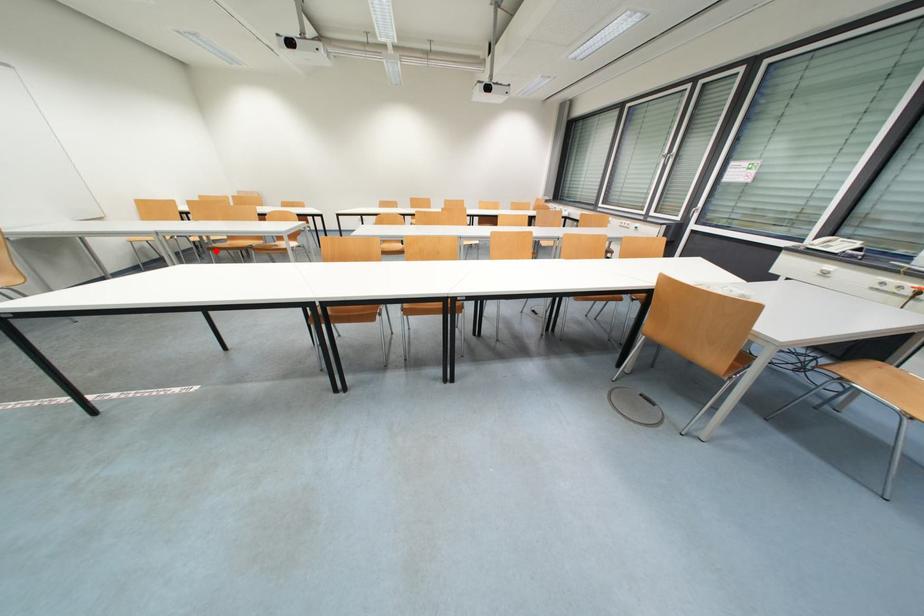
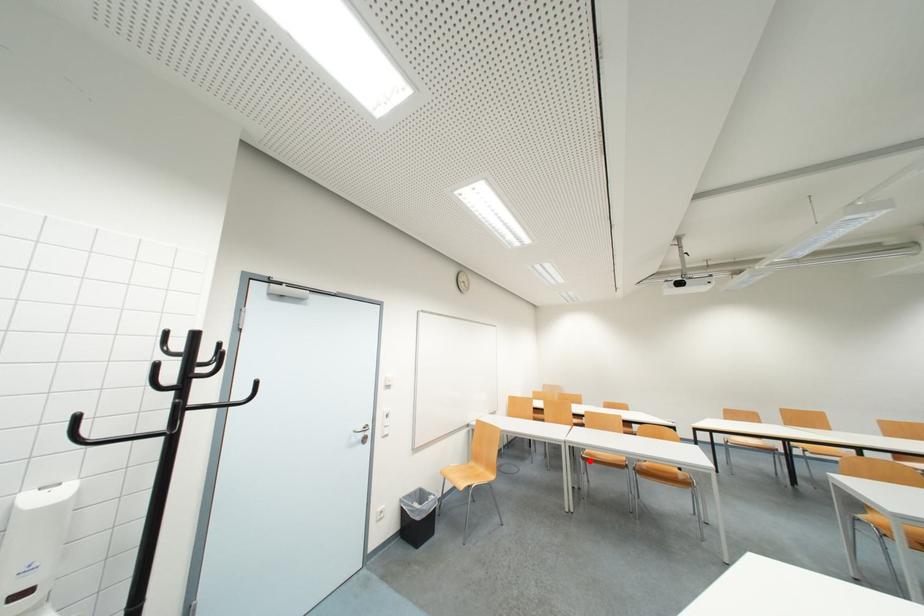
I am providing you with two images of the same scene from different viewpoints. A red point is marked on the first image and another point is marked on the second image. Is the red point in image1 aligned with the point shown in image2?

Yes